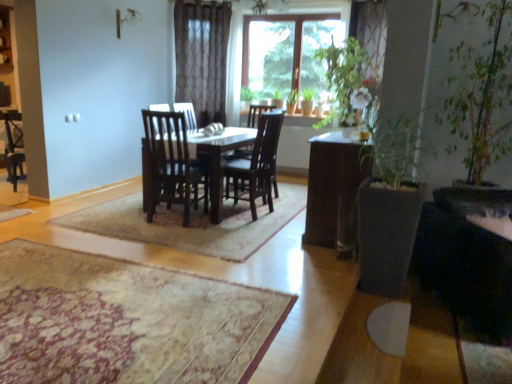
Question: Considering the relative positions of metallic silver lamp at upper center and beige textured rug at center in the image provided, is metallic silver lamp at upper center to the left or to the right of beige textured rug at center?

Choices:
 (A) left
 (B) right

Answer: (A)

Question: From the image's perspective, is metallic silver lamp at upper center above or below beige textured rug at center?

Choices:
 (A) below
 (B) above

Answer: (B)

Question: Which is farther from the metallic silver lamp at upper center?

Choices:
 (A) beige textured rug at center
 (B) matte white cabinet at upper left

Answer: (A)

Question: Which object is positioned farthest from the matte white cabinet at upper left?

Choices:
 (A) metallic silver lamp at upper center
 (B) beige textured rug at center

Answer: (B)